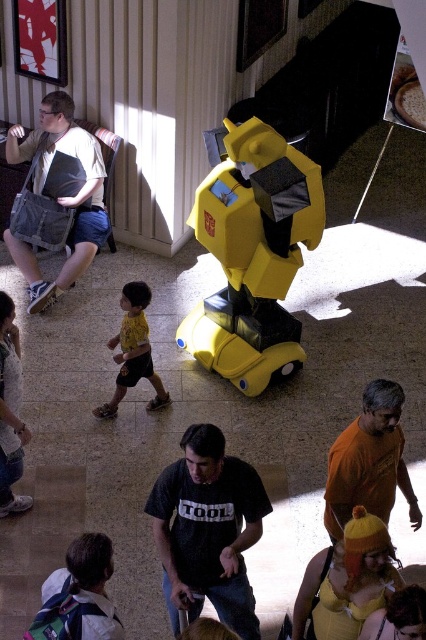
You are standing at point (x=241, y=256) and want to take a photo of the man in a black Tshirt with TOOL printed on it. The camera you have can focus on objects up to 5 meters away. Is the man in a black Tshirt with TOOL printed on it within your camera range?

The distance of point (x=241, y=256) from camera is 5.59 meters, so the man in a black Tshirt with TOOL printed on it is beyond the camera range since it requires focusing up to 5 meters.

You are a photographer at the event and want to take a clear photo of the yellow matte shirt at center without the matte gray bag at left blocking it. What should you do?

Move to the right side of the matte gray bag at left so that the yellow matte shirt at center is no longer blocked by it.

You are standing at the center of the image. Which direction should you move to find the matte gray bag at left?

You should move to the left to find the matte gray bag at left since it is located at point (60, 196), which is to the left of the center.